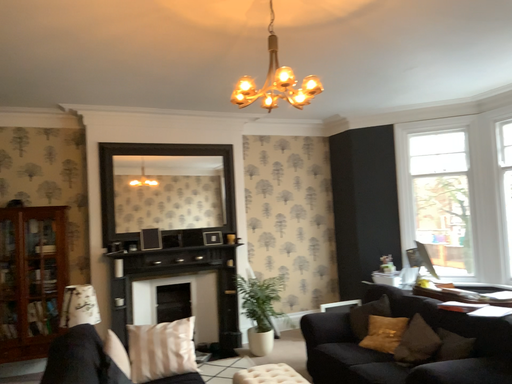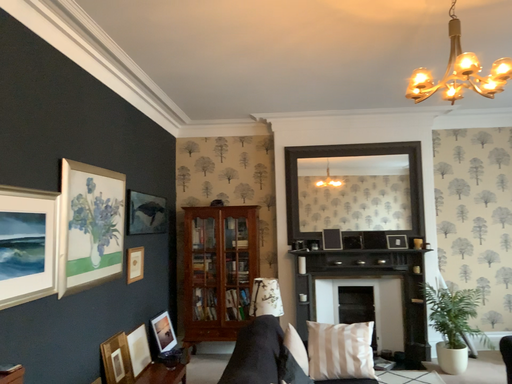
Question: How did the camera likely rotate when shooting the video?

Choices:
 (A) rotated left
 (B) rotated right

Answer: (A)